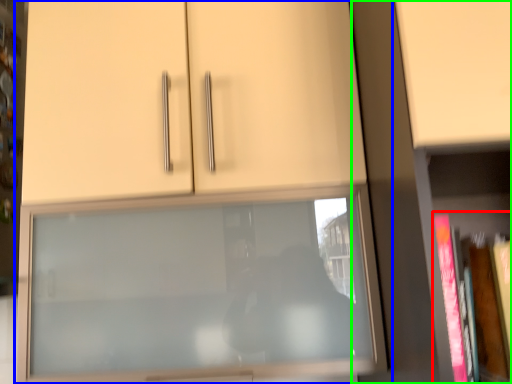
Question: Which object is positioned farthest from book (highlighted by a red box)? Select from cupboard (highlighted by a blue box) and bookcase (highlighted by a green box).

Choices:
 (A) cupboard
 (B) bookcase

Answer: (A)